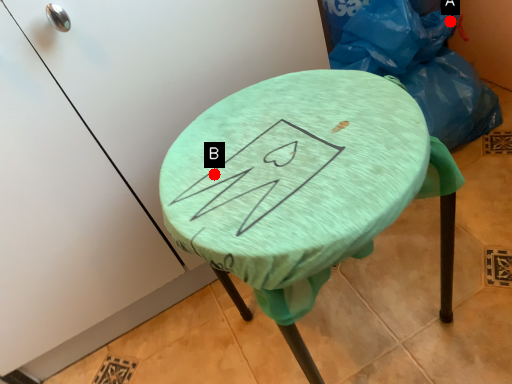
Question: Two points are circled on the image, labeled by A and B beside each circle. Among these points, which one is farthest from the camera?

Choices:
 (A) A is further
 (B) B is further

Answer: (A)